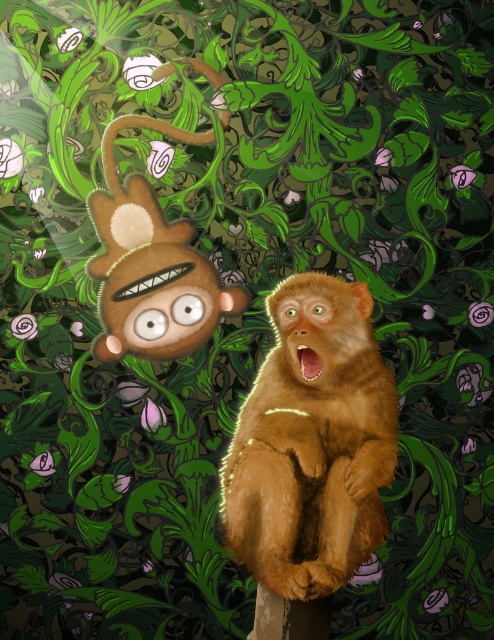
What is the location of the point with coordinates (313, 442) in the image?

The point with coordinates (313, 442) is located on the fuzzy brown monkey at center.

You are a visitor in this surreal garden and want to take a photo of the fuzzy brown monkey at center and the fuzzy brown plush at upper left. Which one will appear closer to the camera in the photo?

The fuzzy brown monkey at center will appear closer to the camera in the photo because it is positioned in front of the fuzzy brown plush at upper left.

You are a visitor in this surreal garden. You see a fuzzy brown monkey at center and a fuzzy brown plush at upper left. Which one is positioned more to the right side of the scene?

The fuzzy brown monkey at center is positioned more to the right side of the scene than the fuzzy brown plush at upper left.